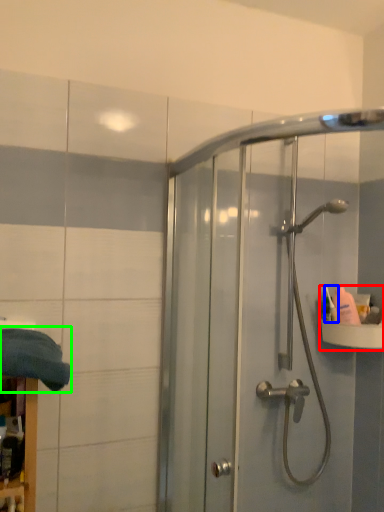
Question: Estimate the real-world distances between objects in this image. Which object is farther from sink (highlighted by a red box), toiletry (highlighted by a blue box) or bath towel (highlighted by a green box)?

Choices:
 (A) toiletry
 (B) bath towel

Answer: (B)